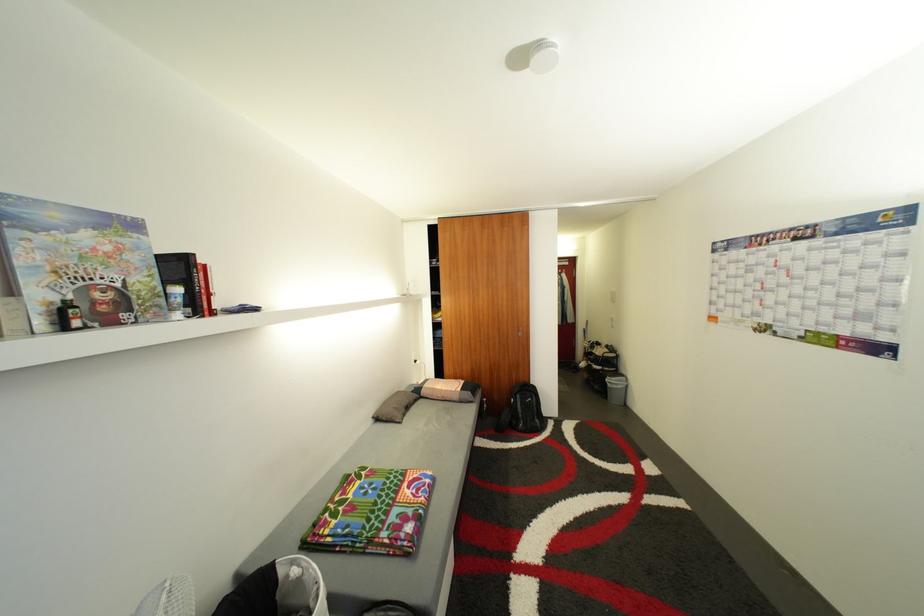
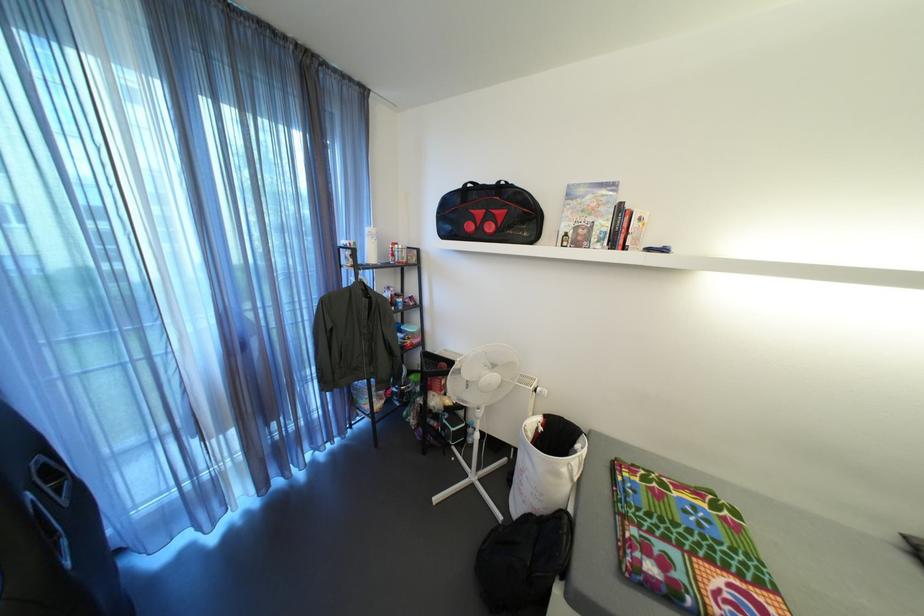
The first image is from the beginning of the video and the second image is from the end. How did the camera likely rotate when shooting the video?

The camera rotated toward left-down.